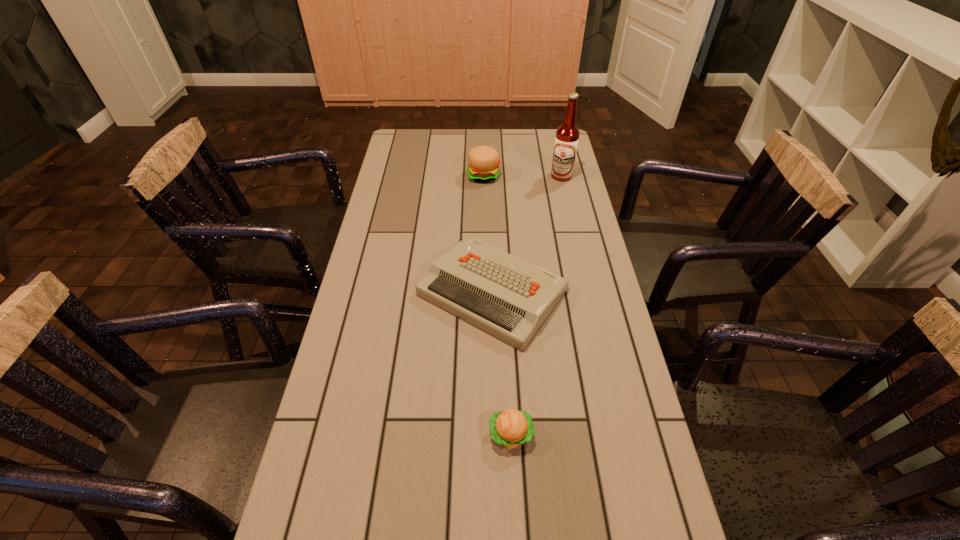
Identify the location of the rightmost object. (567, 135).

Where is `alcohol`? The image size is (960, 540). alcohol is located at coordinates (567, 135).

You are a GUI agent. You are given a task and a screenshot of the screen. Output one action in this format:
    pyautogui.click(x=<x>, y=<y>)
    Task: Click on the third shortest object
    This screenshot has height=540, width=960.
    Given the screenshot: What is the action you would take?
    pyautogui.click(x=484, y=162)

You are a GUI agent. You are given a task and a screenshot of the screen. Output one action in this format:
    pyautogui.click(x=<x>, y=<y>)
    Task: Click on the taller hamburger
    
    Given the screenshot: What is the action you would take?
    pyautogui.click(x=484, y=162)

The width and height of the screenshot is (960, 540). I want to click on the shorter hamburger, so click(511, 428).

Identify the location of the nearer hamburger. 511,428.

At what (x,y) coordinates should I click in order to perform the action: click on the second nearest object. Please return your answer as a coordinate pair (x, y). This screenshot has width=960, height=540. Looking at the image, I should click on (505, 296).

Find the location of `free region located 0.250m on the label side of the alcohol`. free region located 0.250m on the label side of the alcohol is located at coordinates coord(572,225).

Locate an element on the screen. The width and height of the screenshot is (960, 540). vacant space located on the left of the taller hamburger is located at coordinates (427, 176).

The width and height of the screenshot is (960, 540). I want to click on free space located on the right of the shorter hamburger, so click(569, 435).